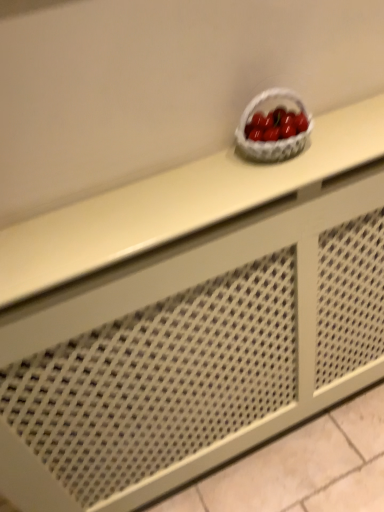
This screenshot has width=384, height=512. In order to click on vacant area located to the right-hand side of white textured basket at upper center in this screenshot , I will do `click(343, 132)`.